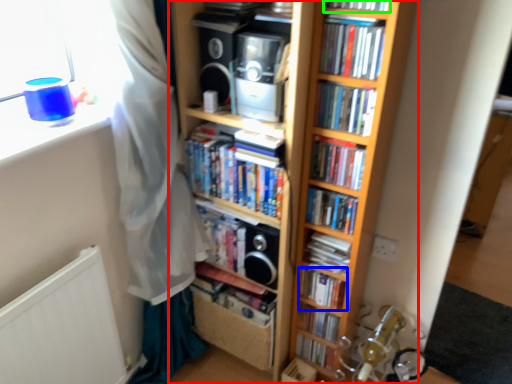
Question: Estimate the real-world distances between objects in this image. Which object is closer to bookcase (highlighted by a red box), book (highlighted by a blue box) or book (highlighted by a green box)?

Choices:
 (A) book
 (B) book

Answer: (A)